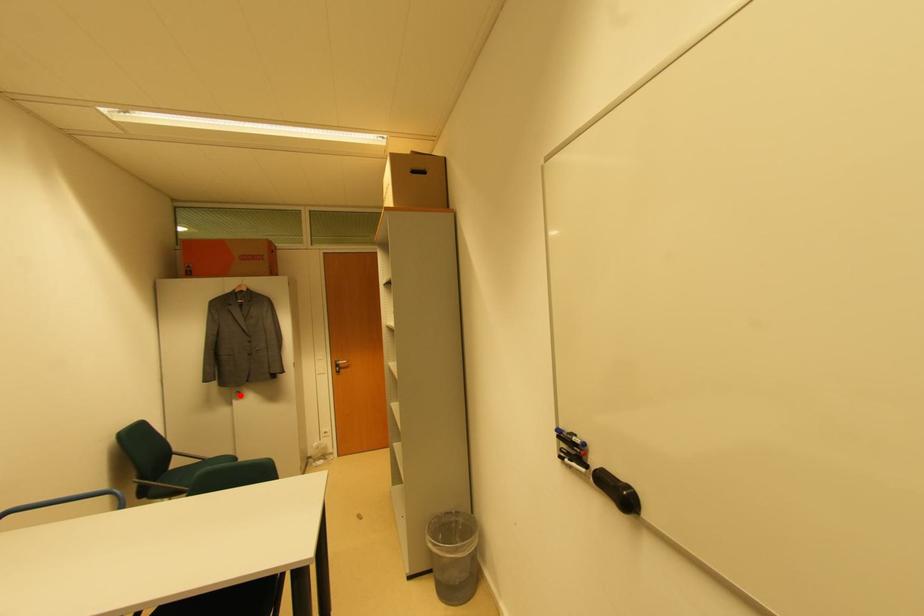
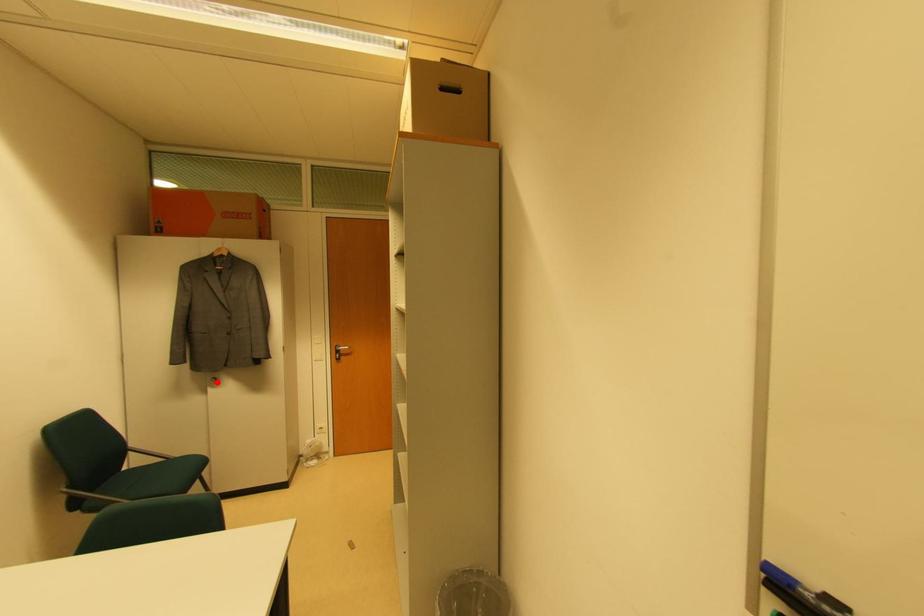
I am providing you with two images of the same scene from different viewpoints. A red point is marked on the first image and another point is marked on the second image. Are the points marked in image1 and image2 representing the same 3D position?

Yes